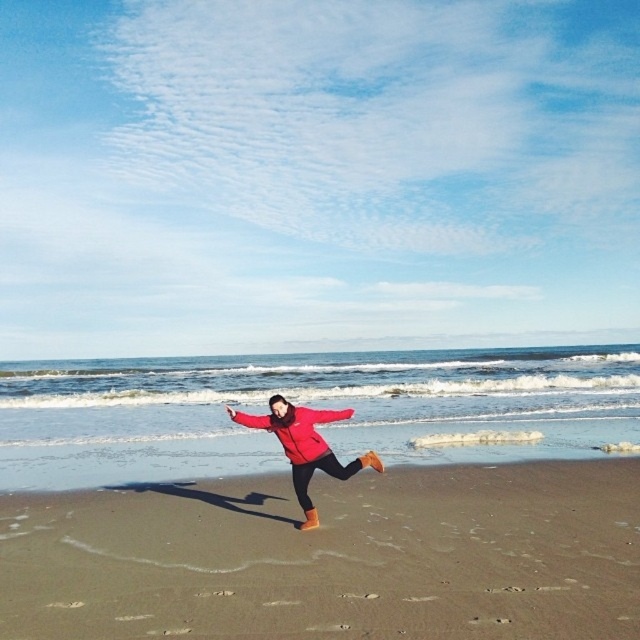
Who is more distant from viewer, (227, 579) or (284, 413)?

Point (284, 413)

Does brown sandy beach at center appear over matte red jacket at center?

Incorrect, brown sandy beach at center is not positioned above matte red jacket at center.

The width and height of the screenshot is (640, 640). Find the location of `brown sandy beach at center`. brown sandy beach at center is located at coordinates (332, 557).